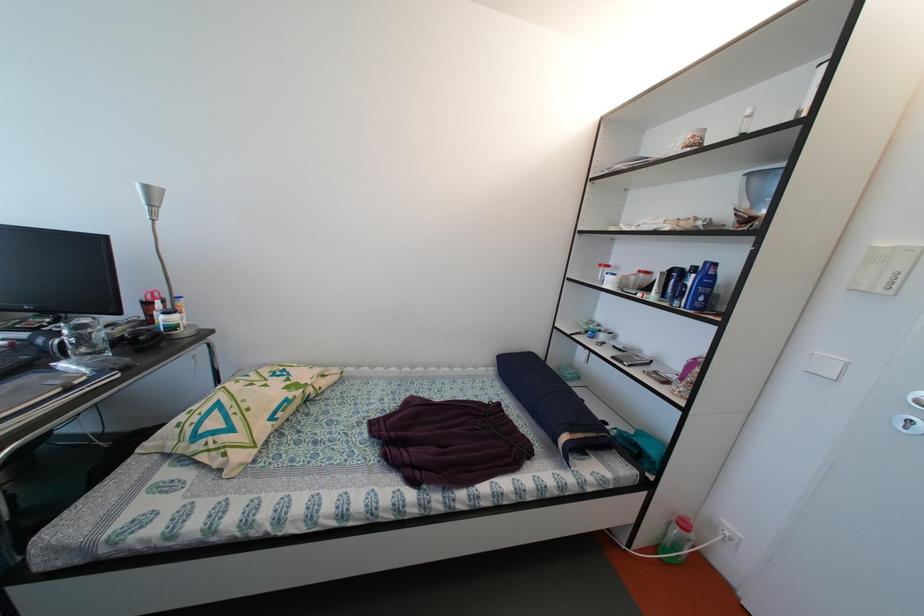
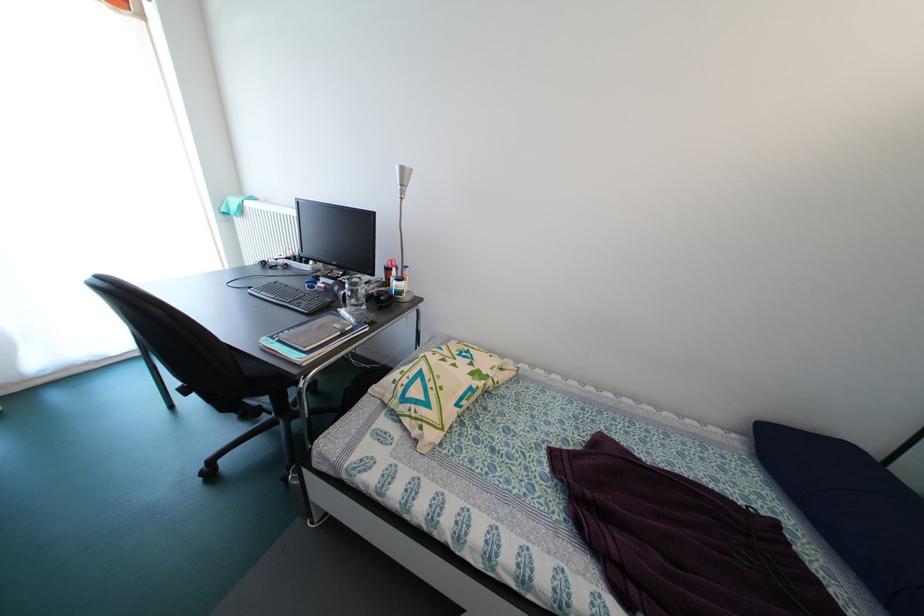
The point at (295, 374) is marked in the first image. Where is the corresponding point in the second image?

(479, 355)